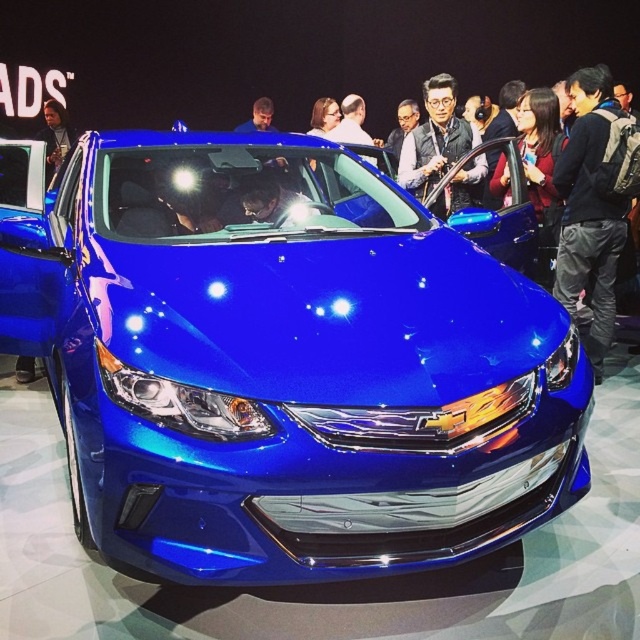
You are a photographer at the auto show. You need to capture a photo of the Chevrolet car without any people in the frame. The black backpack at right and matte black vest at center are blocking your view. Which object is easier to move to clear the view?

The black backpack at right is smaller than the matte black vest at center, so it would be easier to move the black backpack at right to clear the view.